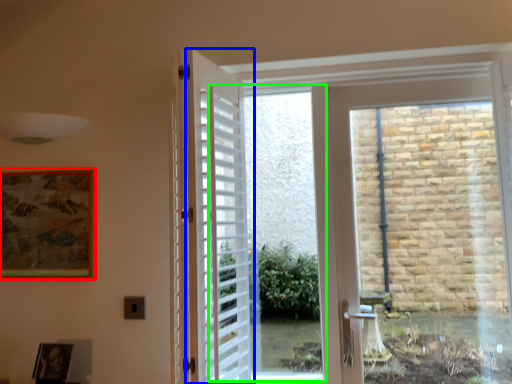
Question: Which is farther away from picture frame (highlighted by a red box)? door (highlighted by a blue box) or window screen (highlighted by a green box)?

Choices:
 (A) door
 (B) window screen

Answer: (B)